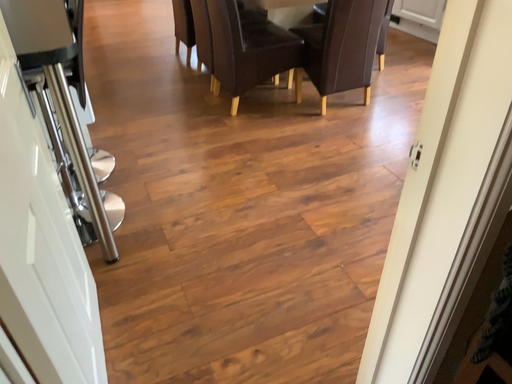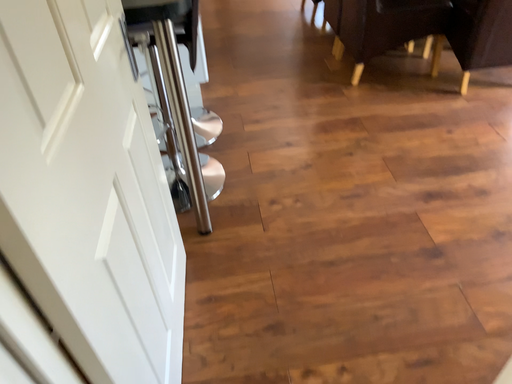
Question: Which way did the camera rotate in the video?

Choices:
 (A) rotated left
 (B) rotated right

Answer: (A)